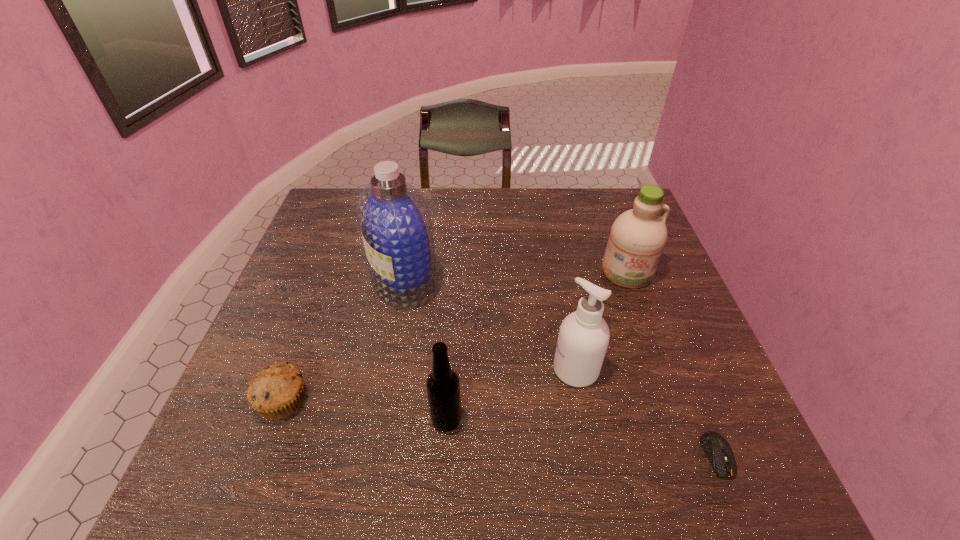
This screenshot has height=540, width=960. I want to click on object located in the near right corner section of the desktop, so click(x=716, y=447).

You are a GUI agent. You are given a task and a screenshot of the screen. Output one action in this format:
    pyautogui.click(x=<x>, y=<y>)
    Task: Click on the free space at the far edge
    
    Given the screenshot: What is the action you would take?
    pyautogui.click(x=448, y=222)

The height and width of the screenshot is (540, 960). I want to click on free space at the near edge of the desktop, so click(x=402, y=471).

Identify the location of blank area at the left edge. (338, 271).

In the image, there is a desktop. Identify the location of vacant space at the right edge. The image size is (960, 540). (701, 426).

In the image, there is a desktop. At what (x,y) coordinates should I click in order to perform the action: click on vacant space at the far left corner. Please return your answer as a coordinate pair (x, y). The height and width of the screenshot is (540, 960). Looking at the image, I should click on (329, 189).

Identify the location of vacant position at the far right corner of the desktop. The height and width of the screenshot is (540, 960). (587, 195).

The image size is (960, 540). In order to click on empty space that is in between the beer bottle and the leftmost object in this screenshot , I will do `click(365, 410)`.

Identify the location of vacant area that lies between the computer equipment and the rightmost cleansing agent. This screenshot has height=540, width=960. click(x=672, y=363).

You are a GUI agent. You are given a task and a screenshot of the screen. Output one action in this format:
    pyautogui.click(x=<x>, y=<y>)
    Task: Click on the vacant space that is in between the rightmost cleansing agent and the fifth object from right to left
    This screenshot has height=540, width=960.
    Given the screenshot: What is the action you would take?
    pyautogui.click(x=516, y=276)